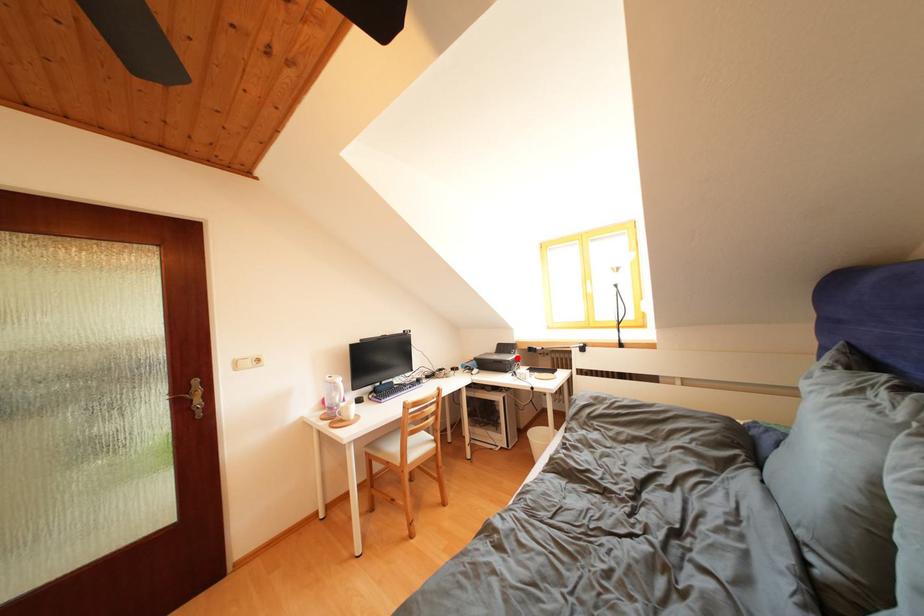
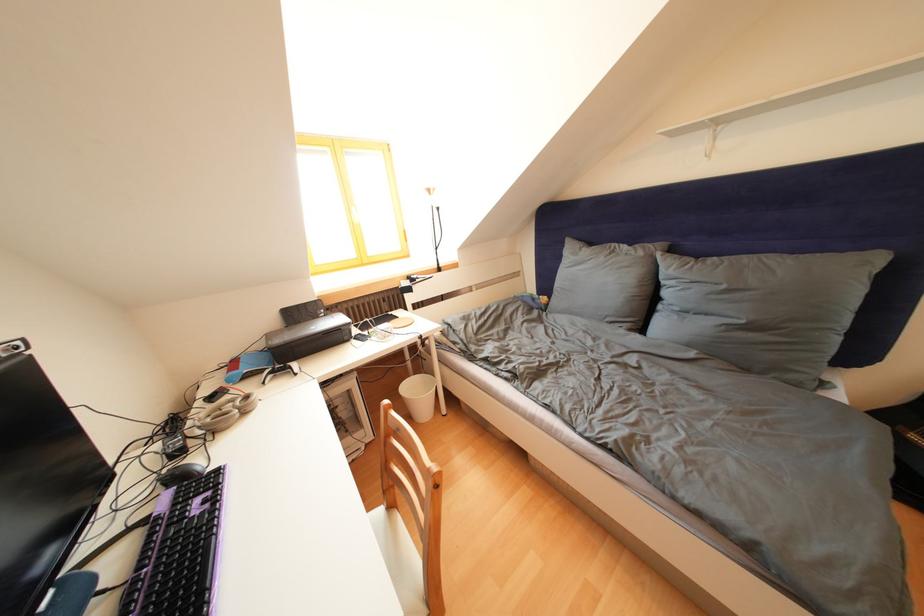
Question: I am providing you with two images of the same scene from different viewpoints. Image1 has a red point marked. In image2, the corresponding 3D location appears at what relative position? Reply with the corresponding letter.

Choices:
 (A) Closer
 (B) Farther

Answer: (A)